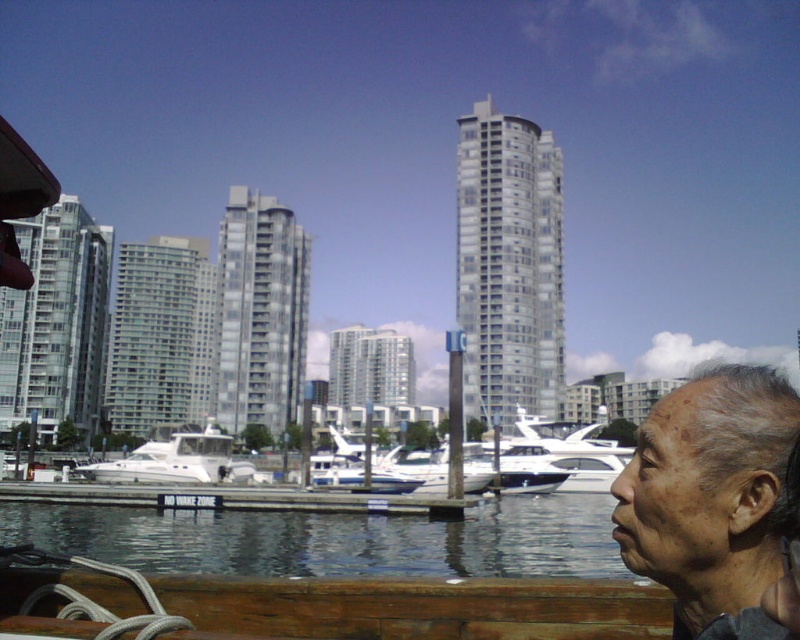
You are a boat operator trying to dock your vessel. You see the white wood dock at lower center and the white glossy boat at center in the water. Which object is closer to you as you approach the dock?

The white wood dock at lower center is closer to you because it is positioned in front of the white glossy boat at center, meaning the dock is nearer to your current position as you approach.

Looking at this image, you are a photographer trying to capture the white wood dock at lower center and the gray hair at lower right in the same frame. Since you want both subjects to be clearly visible, which object should you focus on first to ensure proper depth of field?

The gray hair at lower right has a lesser width compared to the white wood dock at lower center, so you should focus on the white wood dock at lower center first to ensure both are in focus.